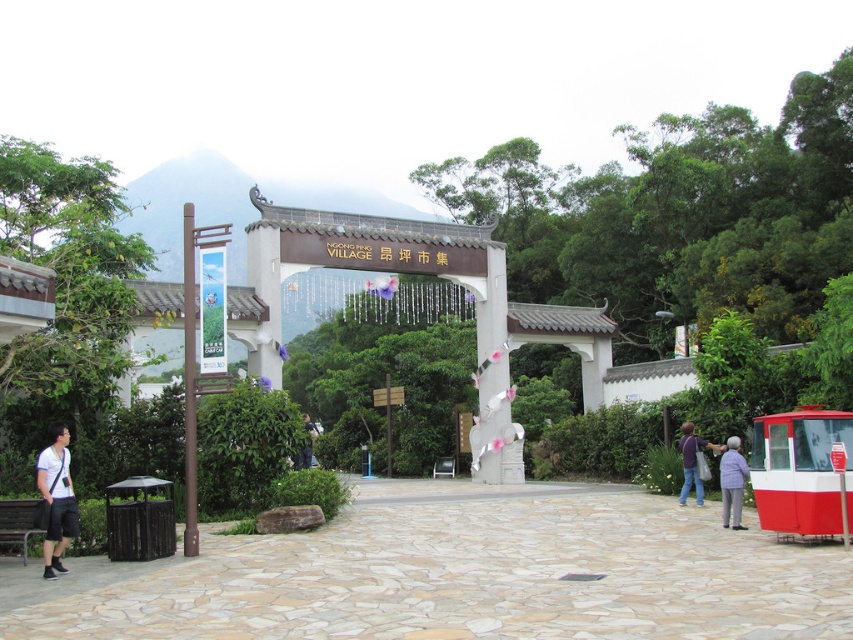
You are standing at the entrance of Ngong Ping Village and see two points marked in the image. The first point is at coordinates point (x=56, y=449) and the second is at point (x=722, y=467). Which point is closer to you?

Point (x=56, y=449) is in front of point (x=722, y=467), so the first point is closer to you.

You are standing at the entrance of Ngong Ping Village and see two pairs of jeans. The dark blue jeans at lower right and the blue denim jeans at center. Which pair of jeans is positioned higher from the ground?

The dark blue jeans at lower right is located above the blue denim jeans at center, so it is positioned higher from the ground.